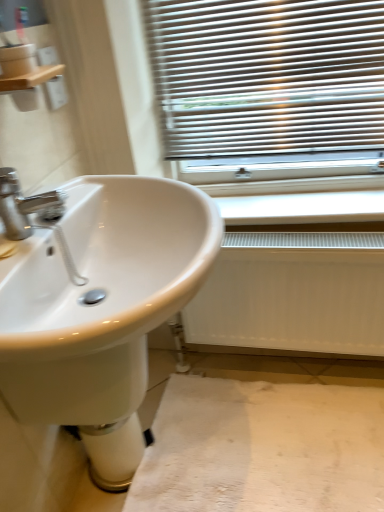
This screenshot has height=512, width=384. Describe the element at coordinates (30, 78) in the screenshot. I see `wooden shelf at upper left` at that location.

What do you see at coordinates (262, 448) in the screenshot? This screenshot has width=384, height=512. I see `white fabric at lower center` at bounding box center [262, 448].

What do you see at coordinates (88, 404) in the screenshot? The width and height of the screenshot is (384, 512). I see `white glossy bidet at lower center` at bounding box center [88, 404].

What is the approximate width of white glossy sink at left?

It is 19.23 inches.

Locate an element on the screen. white plastic radiator at lower center is located at coordinates (302, 208).

Between white plastic radiator at lower center and white glossy sink at left, which one has smaller width?

white plastic radiator at lower center.

In terms of height, does white plastic radiator at lower center look taller or shorter compared to white glossy sink at left?

In the image, white plastic radiator at lower center appears to be shorter than white glossy sink at left.

From the picture: Which is correct: white plastic radiator at lower center is inside white glossy sink at left, or outside of it?

white plastic radiator at lower center is located beyond the bounds of white glossy sink at left.

From a real-world perspective, between white matte radiator at lower right and white fabric at lower center, who is vertically lower?

white fabric at lower center is physically lower.

Can white fabric at lower center be found inside white matte radiator at lower right?

Definitely not — white fabric at lower center is not inside white matte radiator at lower right.

Image resolution: width=384 pixels, height=512 pixels. I want to click on radiator lying above the white fabric at lower center (from the image's perspective), so click(x=293, y=294).

Is white matte radiator at lower right positioned far away from white fabric at lower center?

white matte radiator at lower right is actually quite close to white fabric at lower center.

From a real-world perspective, is wooden shelf at upper left positioned above or below white matte radiator at lower right?

Clearly, from a real-world perspective, wooden shelf at upper left is above white matte radiator at lower right.

Can you confirm if wooden shelf at upper left is smaller than white matte radiator at lower right?

Indeed, wooden shelf at upper left has a smaller size compared to white matte radiator at lower right.

Is white matte radiator at lower right at the back of wooden shelf at upper left?

No.

Does wooden shelf at upper left have a greater width compared to white matte radiator at lower right?

Correct, the width of wooden shelf at upper left exceeds that of white matte radiator at lower right.

Is point (285, 199) positioned in front of point (233, 289)?

No, (285, 199) is behind (233, 289).

Which object is closer to the camera, white plastic radiator at lower center or white matte radiator at lower right?

white matte radiator at lower right is closer to the camera.

Consider the image. Is white plastic radiator at lower center next to white matte radiator at lower right and touching it?

white plastic radiator at lower center and white matte radiator at lower right are not in contact.

Is wooden shelf at upper left turned away from white plastic radiator at lower center?

No, white plastic radiator at lower center is not at the back of wooden shelf at upper left.

From the image's perspective, would you say wooden shelf at upper left is shown under white plastic radiator at lower center?

No, from the image's perspective, wooden shelf at upper left is not below white plastic radiator at lower center.

Considering the relative sizes of wooden shelf at upper left and white plastic radiator at lower center in the image provided, is wooden shelf at upper left taller than white plastic radiator at lower center?

No.

Which object is closer to the camera, wooden shelf at upper left or white plastic radiator at lower center?

wooden shelf at upper left is closer to the camera.

Based on the photo, is white fabric at lower center surrounding wooden shelf at upper left?

No, wooden shelf at upper left is not a part of white fabric at lower center.

How much distance is there between white fabric at lower center and wooden shelf at upper left?

They are 1.17 meters apart.

Are white fabric at lower center and wooden shelf at upper left beside each other?

No, white fabric at lower center is not next to wooden shelf at upper left.

Are wooden shelf at upper left and white glossy bidet at lower center making contact?

No.

In the scene shown: Can you confirm if wooden shelf at upper left is bigger than white glossy bidet at lower center?

No.

From the image's perspective, is wooden shelf at upper left above or below white glossy bidet at lower center?

Clearly, from the image's perspective, wooden shelf at upper left is above white glossy bidet at lower center.

Locate an element on the screen. The width and height of the screenshot is (384, 512). window sill that appears above the white glossy sink at left (from the image's perspective) is located at coordinates (302, 208).

Image resolution: width=384 pixels, height=512 pixels. In order to click on plain that is below the white matte radiator at lower right (from the image's perspective) in this screenshot , I will do (262, 448).

When comparing their distances from white fabric at lower center, does white plastic radiator at lower center or white glossy sink at left seem further?

Among the two, white plastic radiator at lower center is located further to white fabric at lower center.

Estimate the real-world distances between objects in this image. Which object is closer to white fabric at lower center, white plastic radiator at lower center or white glossy bidet at lower center?

white glossy bidet at lower center is positioned closer to the anchor white fabric at lower center.

Estimate the real-world distances between objects in this image. Which object is closer to white plastic radiator at lower center, white fabric at lower center or wooden shelf at upper left?

white fabric at lower center lies closer to white plastic radiator at lower center than the other object.

Estimate the real-world distances between objects in this image. Which object is closer to white matte radiator at lower right, white plastic radiator at lower center or wooden shelf at upper left?

white plastic radiator at lower center.

Based on their spatial positions, is white matte radiator at lower right or white glossy sink at left closer to white glossy bidet at lower center?

The object closer to white glossy bidet at lower center is white glossy sink at left.

Estimate the real-world distances between objects in this image. Which object is closer to white glossy bidet at lower center, white matte radiator at lower right or white plastic radiator at lower center?

white matte radiator at lower right.

Looking at the image, which one is located further to white plastic radiator at lower center, white glossy bidet at lower center or white glossy sink at left?

Among the two, white glossy bidet at lower center is located further to white plastic radiator at lower center.

Based on their spatial positions, is white fabric at lower center or white glossy bidet at lower center closer to white glossy sink at left?

Among the two, white glossy bidet at lower center is located nearer to white glossy sink at left.

Find the location of a particular element. This screenshot has width=384, height=512. plain between white glossy sink at left and white matte radiator at lower right along the z-axis is located at coordinates (262, 448).

Where is `sink between white plastic radiator at lower center and white fabric at lower center from top to bottom`? This screenshot has width=384, height=512. sink between white plastic radiator at lower center and white fabric at lower center from top to bottom is located at coordinates (101, 308).

In order to click on bidet that lies between white plastic radiator at lower center and white fabric at lower center from top to bottom in this screenshot , I will do `click(88, 404)`.

In order to click on sink that lies between wooden shelf at upper left and white fabric at lower center from top to bottom in this screenshot , I will do `click(101, 308)`.